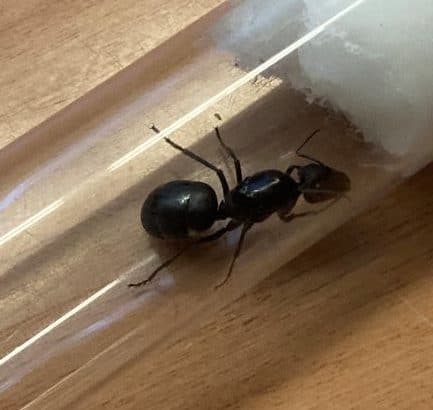
Image resolution: width=433 pixels, height=410 pixels. Identify the location of wood floor. (309, 278).